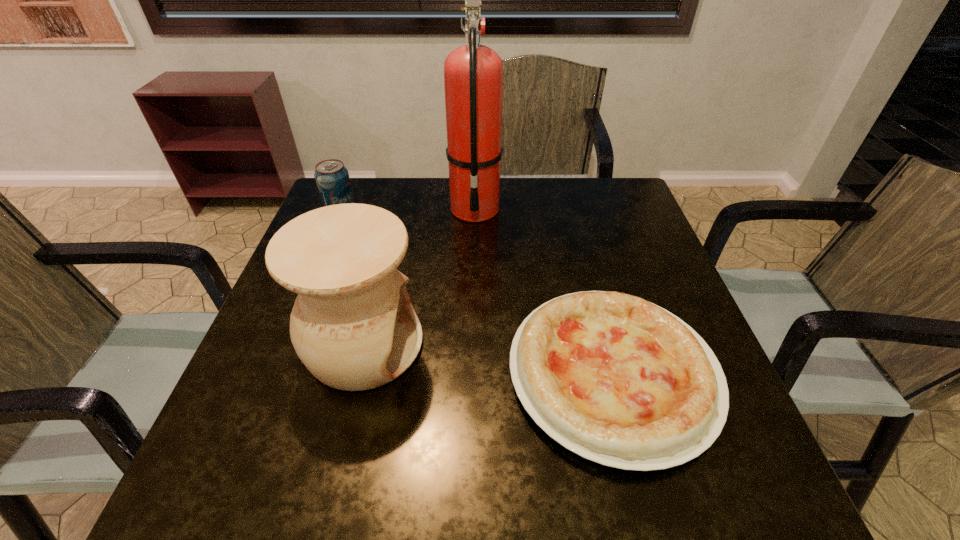
Locate an element on the screen. fire extinguisher is located at coordinates (473, 74).

Locate an element on the screen. The width and height of the screenshot is (960, 540). pottery is located at coordinates (353, 326).

Where is `the third tallest object`? the third tallest object is located at coordinates (332, 178).

Image resolution: width=960 pixels, height=540 pixels. In order to click on pizza in this screenshot , I will do `click(618, 380)`.

You are a GUI agent. You are given a task and a screenshot of the screen. Output one action in this format:
    pyautogui.click(x=<x>, y=<y>)
    Task: Click on the free location located on the hose direction of the fire extinguisher
    Image resolution: width=960 pixels, height=540 pixels.
    Given the screenshot: What is the action you would take?
    pyautogui.click(x=473, y=299)

Locate an element on the screen. This screenshot has height=540, width=960. vacant space situated at the open side of the pottery is located at coordinates (544, 345).

In order to click on vacant space located on the right of the third tallest object in this screenshot , I will do `click(379, 214)`.

Where is `free spot located 0.150m on the left of the pizza`? Image resolution: width=960 pixels, height=540 pixels. free spot located 0.150m on the left of the pizza is located at coordinates (428, 374).

The width and height of the screenshot is (960, 540). I want to click on fire extinguisher present at the far edge, so click(x=473, y=74).

Where is `pop soda located in the far edge section of the desktop`? The image size is (960, 540). pop soda located in the far edge section of the desktop is located at coordinates tap(332, 178).